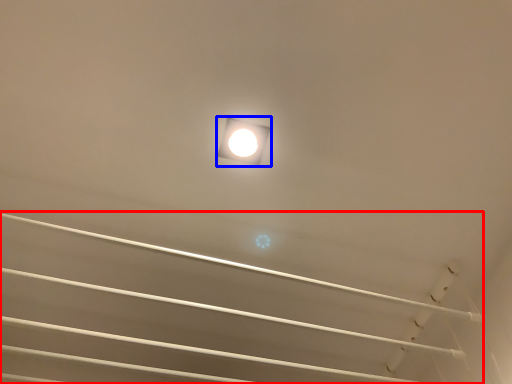
Question: Which of the following is the closest to the observer, stairwell (highlighted by a red box) or lamp (highlighted by a blue box)?

Choices:
 (A) stairwell
 (B) lamp

Answer: (A)